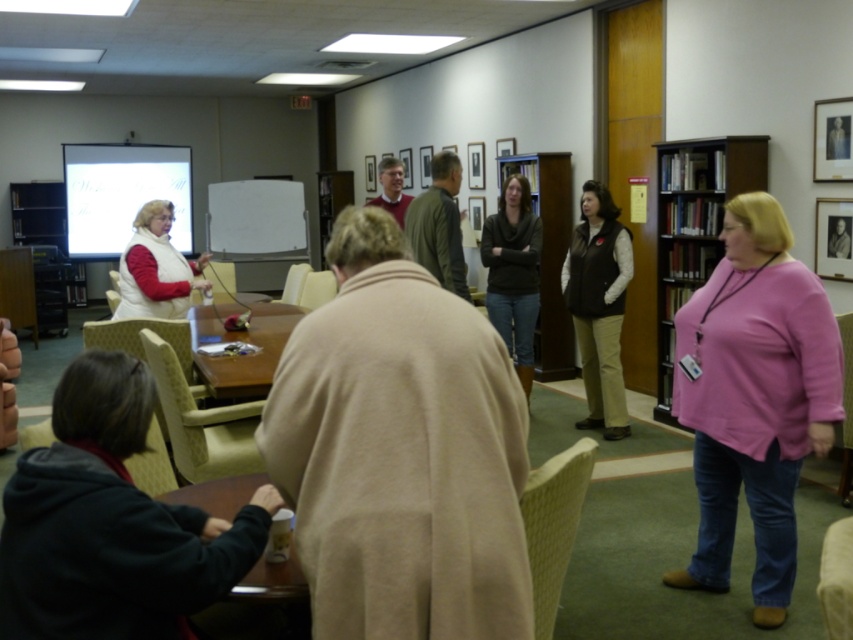
Question: Which of the following is the closest to the observer?

Choices:
 (A) brown wooden bookshelf at center
 (B) light yellow textured chair at center
 (C) beige fabric chair at center

Answer: (B)

Question: Which point is farther to the camera?

Choices:
 (A) (141, 148)
 (B) (830, 630)
 (C) (189, 474)
 (D) (4, 328)

Answer: (A)

Question: Does matte black vest at center have a greater width compared to white matte projection screen at upper left?

Choices:
 (A) no
 (B) yes

Answer: (A)

Question: Is white matte projection screen at upper left smaller than dark gray sweater at center?

Choices:
 (A) yes
 (B) no

Answer: (B)

Question: In this image, where is light yellow textured chair at center located relative to matte white vest at left?

Choices:
 (A) below
 (B) above

Answer: (A)

Question: Which of these objects is positioned closest to the matte black vest at center?

Choices:
 (A) pink fabric chair at lower right
 (B) white fabric chair at lower right
 (C) matte beige chair at lower left

Answer: (A)